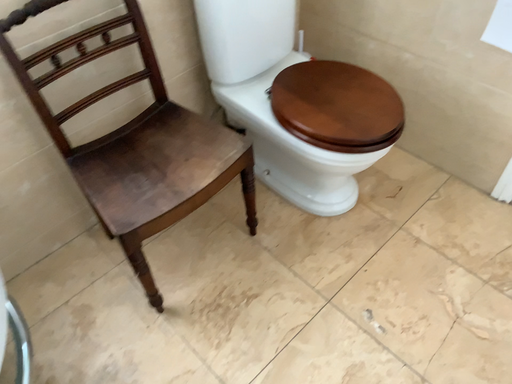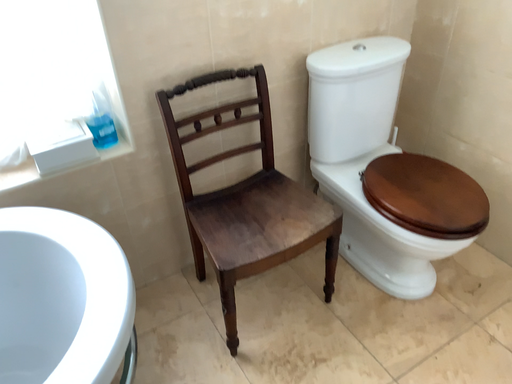
Question: Which way did the camera rotate in the video?

Choices:
 (A) rotated left
 (B) rotated right

Answer: (A)